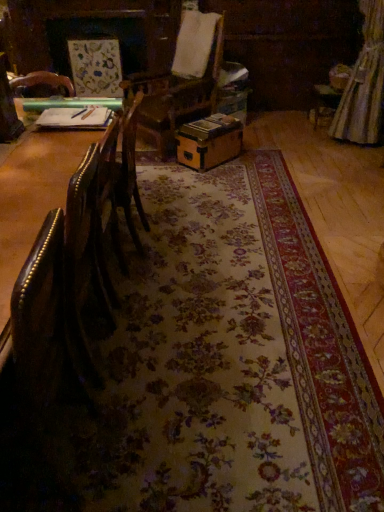
Question: Looking at the image, does silky beige curtain at upper right seem bigger or smaller compared to leather couch at left?

Choices:
 (A) big
 (B) small

Answer: (B)

Question: From the image's perspective, is silky beige curtain at upper right positioned above or below leather couch at left?

Choices:
 (A) below
 (B) above

Answer: (B)

Question: Considering the real-world distances, which object is farthest from the wooden box at center?

Choices:
 (A) silky beige curtain at upper right
 (B) leather couch at left

Answer: (B)

Question: Which object is positioned farthest from the wooden box at center?

Choices:
 (A) silky beige curtain at upper right
 (B) leather couch at left

Answer: (B)